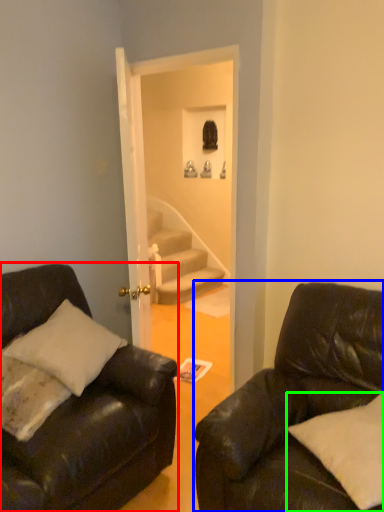
Question: Which object is positioned farthest from studio couch (highlighted by a red box)? Select from studio couch (highlighted by a blue box) and pillow (highlighted by a green box).

Choices:
 (A) studio couch
 (B) pillow

Answer: (B)